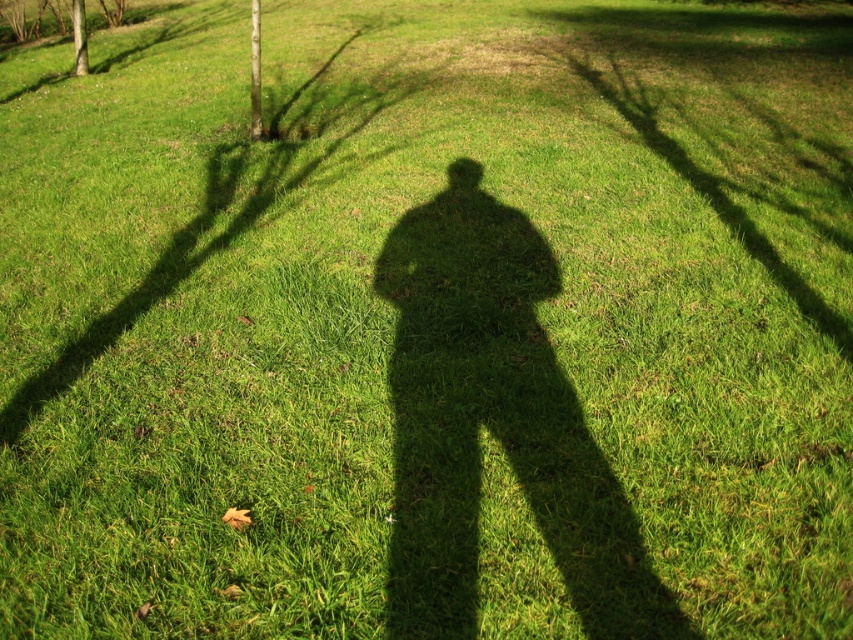
Consider the image. You are standing in the grassy area and see the green leafy tree at upper left and the smooth brown tree trunk at upper left. Which one is positioned more to the right side?

The green leafy tree at upper left is positioned to the right of the smooth brown tree trunk at upper left, so the green leafy tree at upper left is more to the right side.

You are standing in the grassy area and want to find the green leafy tree at upper left. Which direction should you look relative to the smooth brown tree trunk at upper left?

The green leafy tree at upper left is located above the smooth brown tree trunk at upper left, so you should look upward from the smooth brown tree trunk at upper left to find it.